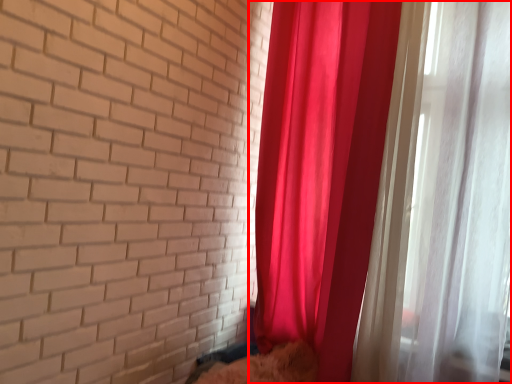
Question: From the image's perspective, considering the relative positions of curtain (annotated by the red box) and animal in the image provided, where is curtain (annotated by the red box) located with respect to the staircase?

Choices:
 (A) above
 (B) below

Answer: (A)